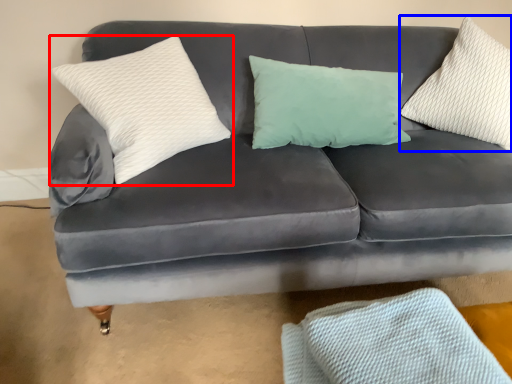
Question: Which point is closer to the camera, pillow (highlighted by a red box) or pillow (highlighted by a blue box)?

Choices:
 (A) pillow
 (B) pillow

Answer: (A)